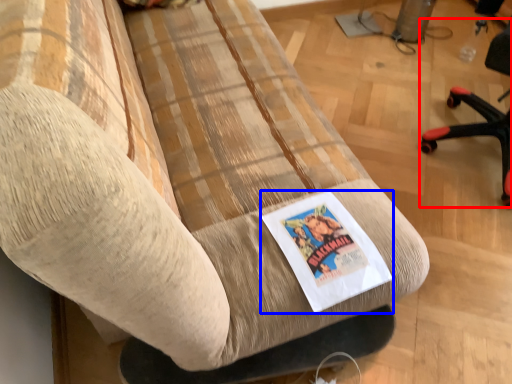
Question: Which point is further to the camera, chair (highlighted by a red box) or flyer (highlighted by a blue box)?

Choices:
 (A) chair
 (B) flyer

Answer: (A)